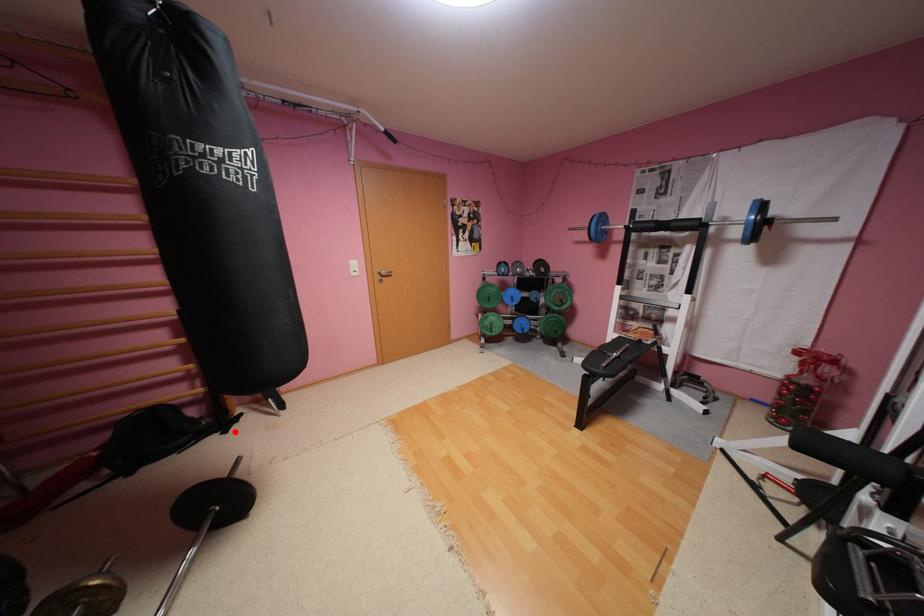
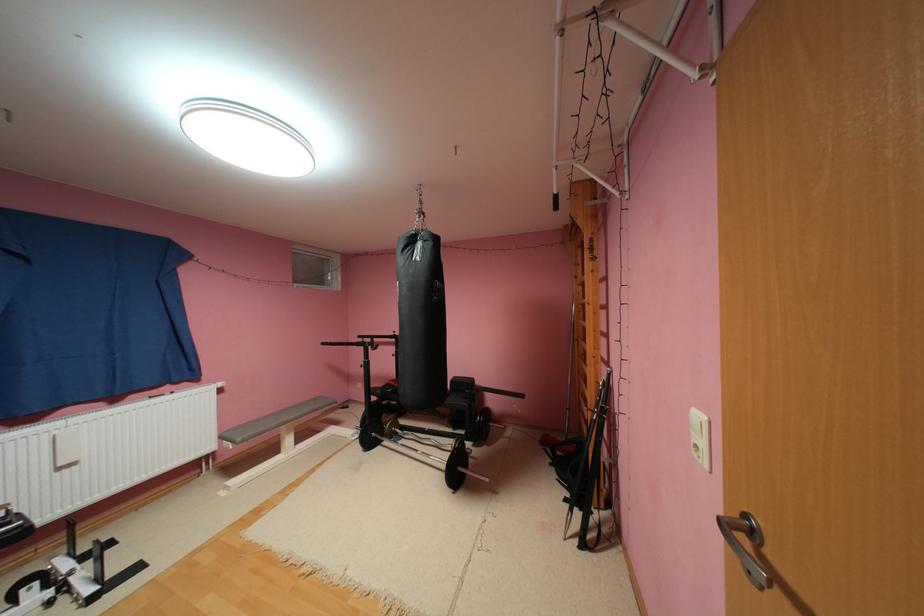
The point at the highlighted location is marked in the first image. Where is the corresponding point in the second image?

(575, 500)